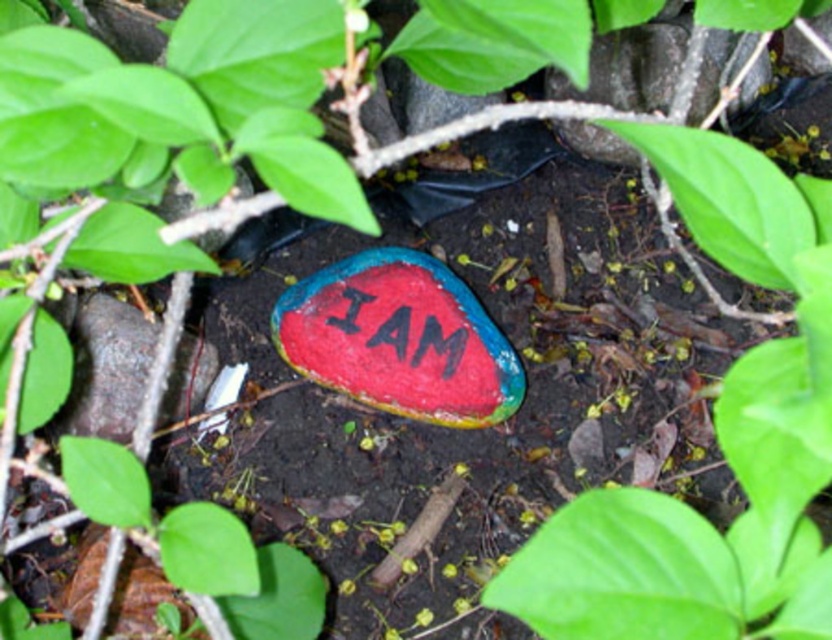
Which is below, green matte rock at center or painted rock at center?

painted rock at center is lower down.

Can you confirm if green matte rock at center is positioned to the left of painted rock at center?

Incorrect, green matte rock at center is not on the left side of painted rock at center.

Is point (763, 262) closer to camera compared to point (116, 396)?

Yes, point (763, 262) is closer to viewer.

The width and height of the screenshot is (832, 640). I want to click on green matte rock at center, so tap(717, 440).

Between point (687, 609) and point (580, 145), which one is positioned behind?

Positioned behind is point (580, 145).

Between point (775, 627) and point (613, 35), which one is positioned in front?

Positioned in front is point (775, 627).

Does point (697, 161) come closer to viewer compared to point (592, 83)?

Yes, it is.

Where is `green matte rock at center`? This screenshot has height=640, width=832. green matte rock at center is located at coordinates (717, 440).

Which is more to the right, smooth painted rock at center or painted rock at center?

From the viewer's perspective, smooth painted rock at center appears more on the right side.

Between point (602, 68) and point (78, 397), which one is positioned behind?

Positioned behind is point (602, 68).

This screenshot has height=640, width=832. What do you see at coordinates (630, 67) in the screenshot?
I see `smooth painted rock at center` at bounding box center [630, 67].

Locate an element on the screen. The image size is (832, 640). smooth painted rock at center is located at coordinates (630, 67).